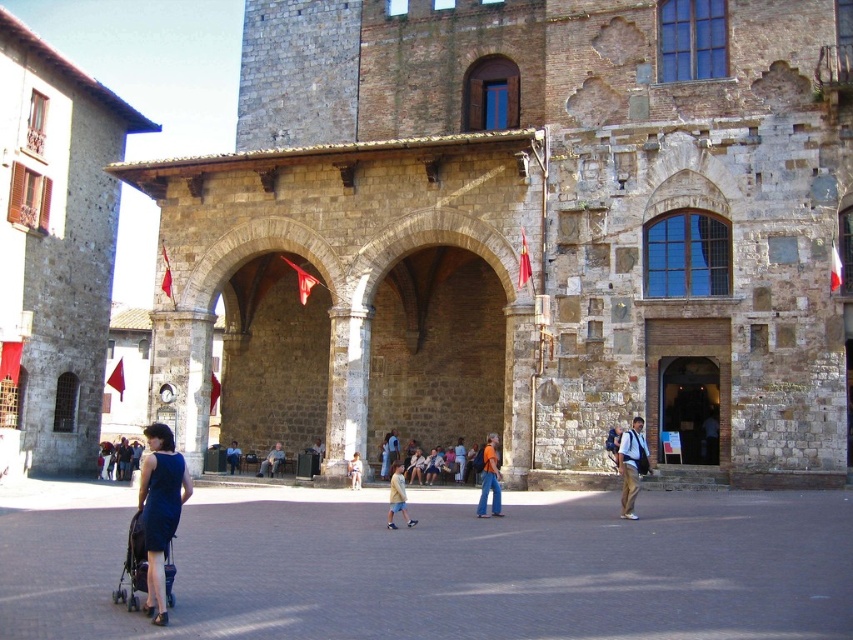
Question: Which point is farther from the camera taking this photo?

Choices:
 (A) (310, 476)
 (B) (231, 472)
 (C) (637, 474)
 (D) (496, 486)

Answer: (B)

Question: Can you confirm if light yellow cotton shirt at center is positioned below light brown wooden chair at center?

Choices:
 (A) no
 (B) yes

Answer: (A)

Question: Which point is farther from the camera taking this photo?

Choices:
 (A) (270, 461)
 (B) (625, 458)

Answer: (A)

Question: Does light brown wooden chair at center appear on the right side of light brown leather jacket at center?

Choices:
 (A) yes
 (B) no

Answer: (B)

Question: Which point appears closest to the camera in this image?

Choices:
 (A) (491, 460)
 (B) (395, 497)

Answer: (B)

Question: Can you confirm if khaki pants at center is positioned to the right of light brown wooden bench at center?

Choices:
 (A) no
 (B) yes

Answer: (B)